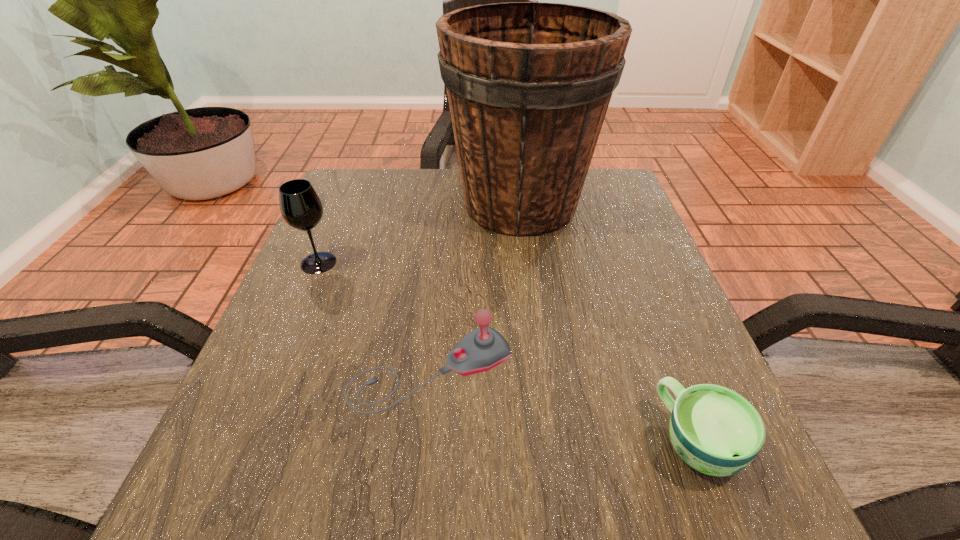
You are a GUI agent. You are given a task and a screenshot of the screen. Output one action in this format:
    pyautogui.click(x=<x>, y=<y>)
    Task: Click on the object at the far edge
    
    Given the screenshot: What is the action you would take?
    pyautogui.click(x=528, y=84)

Identify the location of object present at the near edge. This screenshot has width=960, height=540. (716, 431).

Where is `wineglass that is at the left edge`? This screenshot has width=960, height=540. wineglass that is at the left edge is located at coordinates (301, 208).

Locate an element on the screen. The width and height of the screenshot is (960, 540). joystick that is at the left edge is located at coordinates (484, 348).

Identify the location of bucket present at the right edge. Image resolution: width=960 pixels, height=540 pixels. (528, 84).

The width and height of the screenshot is (960, 540). In order to click on cup located at the right edge in this screenshot , I will do `click(716, 431)`.

Find the location of a particular element. Image resolution: width=960 pixels, height=540 pixels. object that is at the far right corner is located at coordinates (528, 84).

Where is `object located in the near right corner section of the desktop`? Image resolution: width=960 pixels, height=540 pixels. object located in the near right corner section of the desktop is located at coordinates (716, 431).

Locate an element on the screen. free location at the far edge of the desktop is located at coordinates (442, 207).

In the image, there is a desktop. Where is `free space at the left edge`? The width and height of the screenshot is (960, 540). free space at the left edge is located at coordinates click(315, 241).